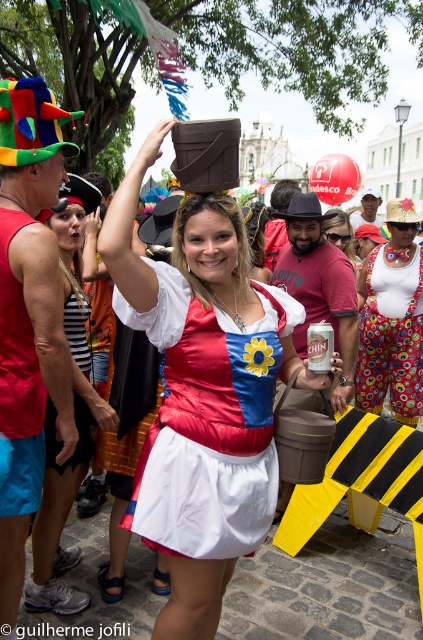
Question: Does red fabric tank top at left appear over matte black hat at upper center?

Choices:
 (A) yes
 (B) no

Answer: (B)

Question: Does satin dress at center have a lesser width compared to white fabric dress at center?

Choices:
 (A) no
 (B) yes

Answer: (A)

Question: Which point appears closest to the camera in this image?

Choices:
 (A) (134, 480)
 (B) (36, 538)
 (C) (362, 196)

Answer: (A)

Question: Which object is positioned farthest from the floral-patterned pants at center?

Choices:
 (A) red fabric tank top at left
 (B) white fabric dress at center
 (C) matte black hat at upper center
 (D) satin dress at center

Answer: (A)

Question: Observing the image, what is the correct spatial positioning of matte brown hat at upper center in reference to white fabric dress at center?

Choices:
 (A) below
 (B) above

Answer: (A)

Question: Which object appears farthest from the camera in this image?

Choices:
 (A) matte black hat at upper center
 (B) floral-patterned pants at center

Answer: (A)